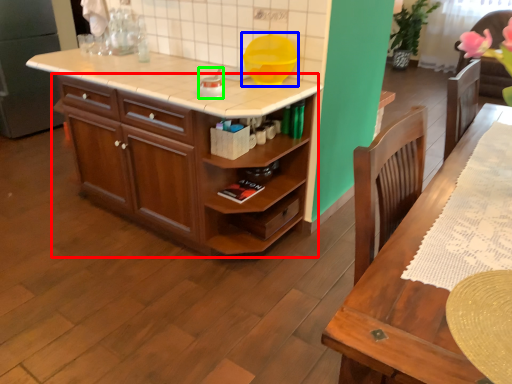
Question: Which is nearer to the cabinetry (highlighted by a red box)? appliance (highlighted by a blue box) or appliance (highlighted by a green box).

Choices:
 (A) appliance
 (B) appliance

Answer: (B)